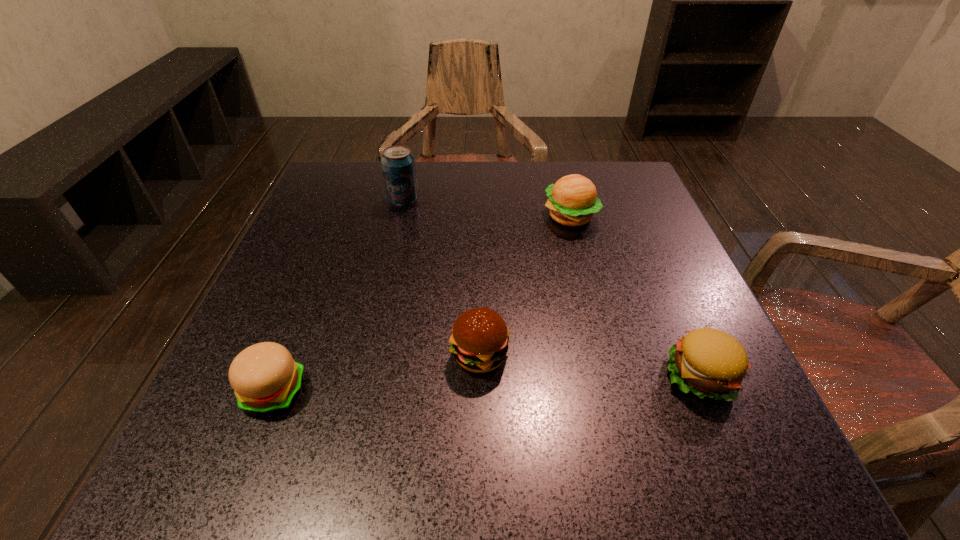
Locate an element on the screen. free point at the near left corner is located at coordinates (183, 471).

This screenshot has width=960, height=540. Find the location of `vacant area at the far right corner`. vacant area at the far right corner is located at coordinates (x=629, y=189).

This screenshot has width=960, height=540. Identify the location of vacant space at the near right corner. (758, 426).

Find the location of `unoccupied area between the farthest hamburger and the leftmost hamburger`. unoccupied area between the farthest hamburger and the leftmost hamburger is located at coordinates (422, 304).

This screenshot has width=960, height=540. What are the coordinates of `empty space that is in between the third object from left to right and the rightmost object` in the screenshot? It's located at tap(590, 365).

What are the coordinates of `empty location between the second object from left to right and the rightmost object` in the screenshot? It's located at (552, 288).

Find the location of a particular element. Image resolution: width=960 pixels, height=540 pixels. empty space between the leftmost hamburger and the pop soda is located at coordinates (339, 296).

Locate an element on the screen. The width and height of the screenshot is (960, 540). free spot between the third hamburger from right to left and the pop soda is located at coordinates (442, 278).

Locate an element on the screen. The width and height of the screenshot is (960, 540). free spot between the leftmost hamburger and the second object from right to left is located at coordinates (422, 304).

Find the location of a particular element. The height and width of the screenshot is (540, 960). free area in between the third object from left to right and the rightmost hamburger is located at coordinates (590, 365).